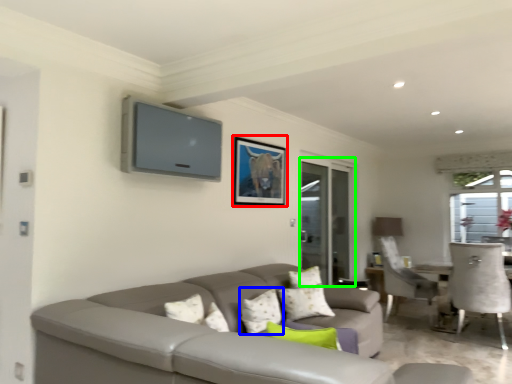
Question: Which is farther away from picture frame (highlighted by a red box)? pillow (highlighted by a blue box) or screen door (highlighted by a green box)?

Choices:
 (A) pillow
 (B) screen door

Answer: (B)